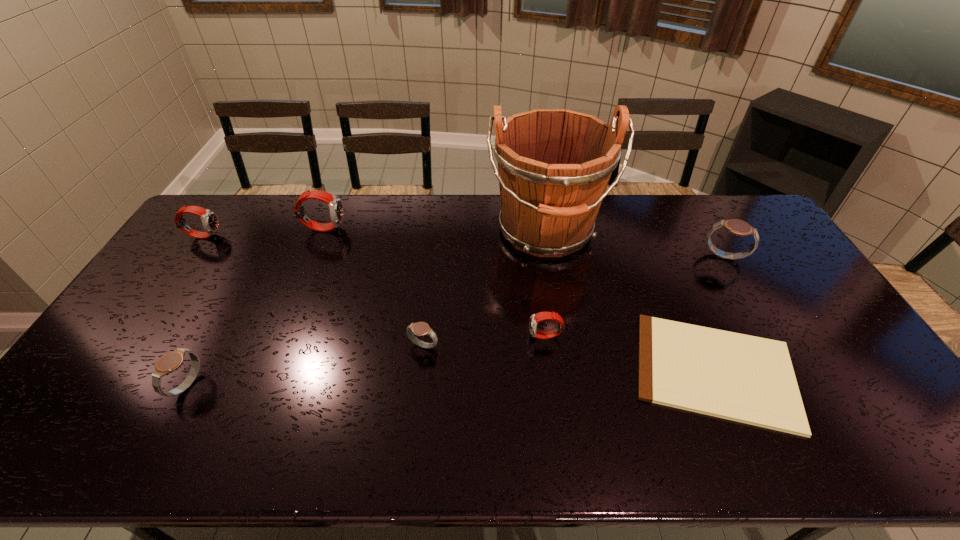
You are a GUI agent. You are given a task and a screenshot of the screen. Output one action in this format:
    pyautogui.click(x=<x>, y=<y>)
    Task: Click on the bucket
    
    Given the screenshot: What is the action you would take?
    coord(554,165)

Locate an element on the screen. The image size is (960, 540). the fourth watch from right to left is located at coordinates (335, 205).

You are a GUI agent. You are given a task and a screenshot of the screen. Output one action in this format:
    pyautogui.click(x=<x>, y=<y>)
    Task: Click on the second red watch from right to left
    This screenshot has width=960, height=540.
    Given the screenshot: What is the action you would take?
    pyautogui.click(x=335, y=205)

The width and height of the screenshot is (960, 540). I want to click on the farthest gray watch, so click(738, 227).

The width and height of the screenshot is (960, 540). What are the coordinates of `the third farthest watch` in the screenshot? It's located at (738, 227).

Image resolution: width=960 pixels, height=540 pixels. I want to click on the leftmost object, so click(x=210, y=222).

The image size is (960, 540). Find the location of `the leftmost watch`. the leftmost watch is located at coordinates (210, 222).

Find the location of a particular element. the leftmost gray watch is located at coordinates (170, 362).

This screenshot has width=960, height=540. What are the coordinates of `the second object from left to right` in the screenshot? It's located at (170, 362).

Find the location of a particular element. the fifth watch from left to right is located at coordinates (535, 318).